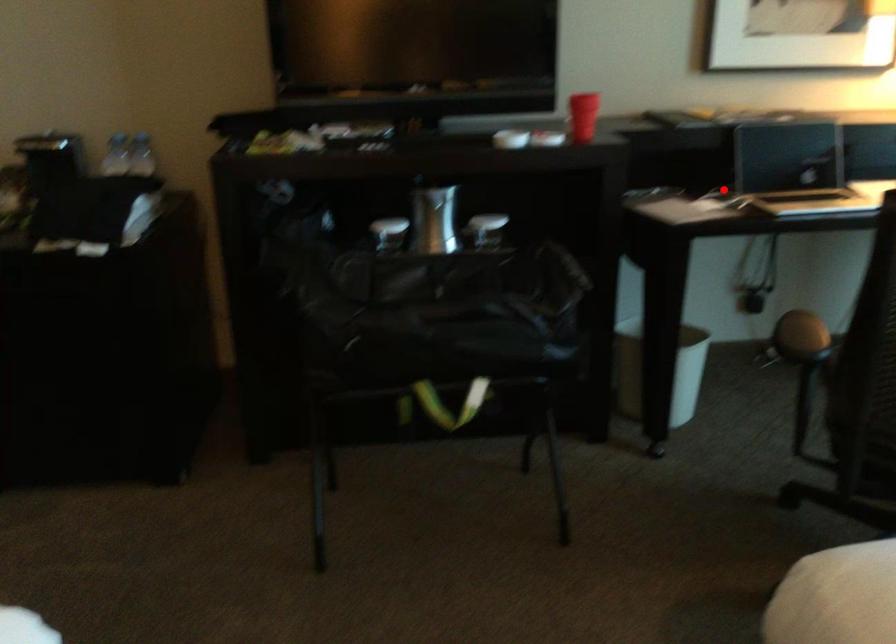
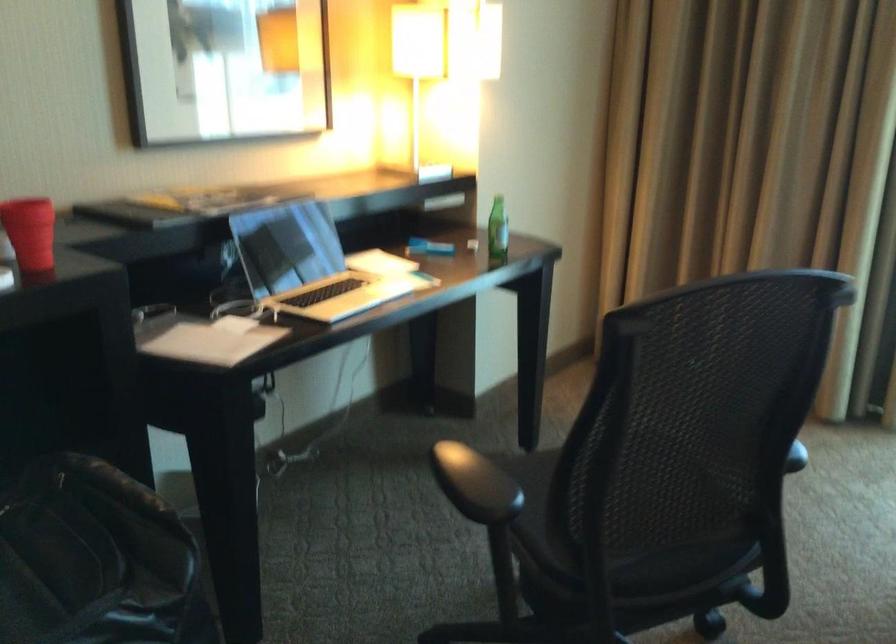
Find the pixel in the second image that matches the highlighted location in the first image.

(237, 304)